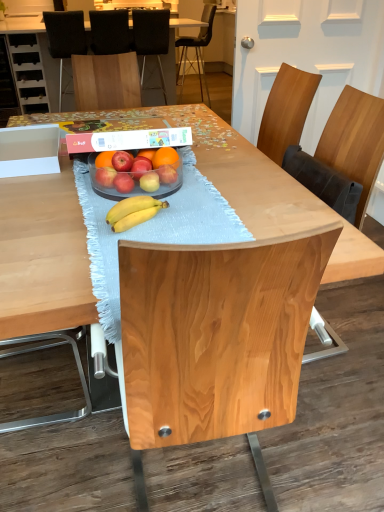
Identify the location of unoccupied area in front of matte red apple at center, placed as the 6th apple when sorted from left to right. The width and height of the screenshot is (384, 512). (177, 207).